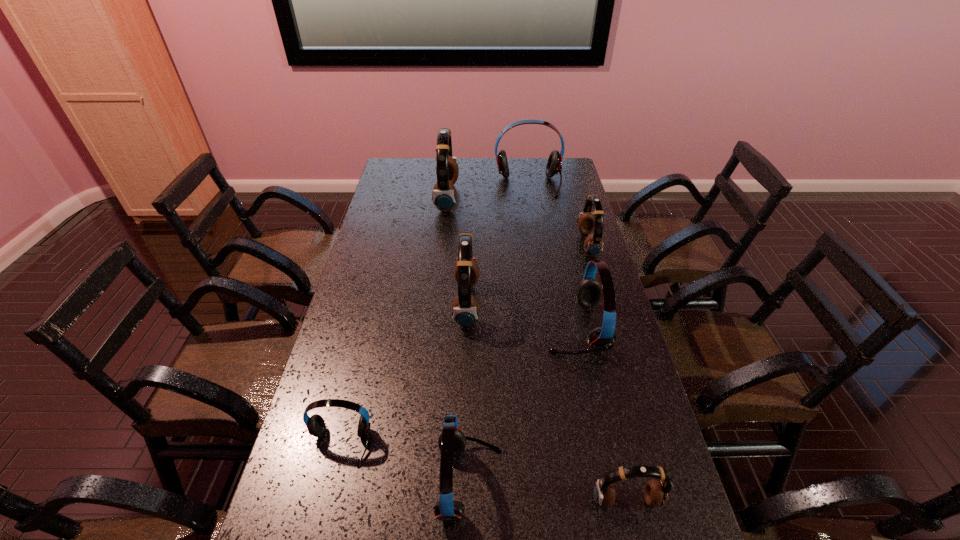
Select which object appears as the fifth closest to the second biggest brown headset. Please provide its 2D coordinates. Your answer should be formatted as a tuple, i.e. [(x, y)], where the tuple contains the x and y coordinates of a point satisfying the conditions above.

[(587, 221)]

Select which object appears as the second closest to the leftmost brown headset. Please provide its 2D coordinates. Your answer should be formatted as a tuple, i.e. [(x, y)], where the tuple contains the x and y coordinates of a point satisfying the conditions above.

[(465, 309)]

The width and height of the screenshot is (960, 540). I want to click on the third closest headset to the farthest red headset, so click(465, 309).

Find the location of a particular element. The image size is (960, 540). the closest headset to the farthest red headset is located at coordinates (444, 196).

The image size is (960, 540). I want to click on brown headset that can be found as the closest to the third nearest red headset, so click(x=587, y=221).

Locate which brown headset ranks in proximity to the smallest red headset. Please provide its 2D coordinates. Your answer should be formatted as a tuple, i.e. [(x, y)], where the tuple contains the x and y coordinates of a point satisfying the conditions above.

[(465, 309)]

Identify which red headset is located as the fourth nearest to the nearest brown headset. Please provide its 2D coordinates. Your answer should be formatted as a tuple, i.e. [(x, y)], where the tuple contains the x and y coordinates of a point satisfying the conditions above.

[(554, 164)]

The height and width of the screenshot is (540, 960). Identify the location of the second closest red headset relative to the smallest red headset. (589, 292).

This screenshot has height=540, width=960. I want to click on vacant area that satisfies the following two spatial constraints: 1. on the ear cup of the third farthest object; 2. with the microphone attached to the side of the smallest red headset, so click(647, 445).